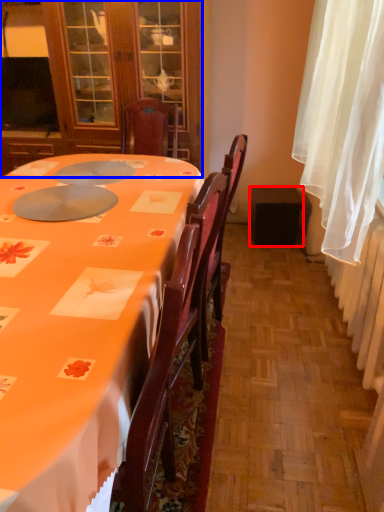
Question: Which point is closer to the camera, loudspeaker (highlighted by a red box) or cabinetry (highlighted by a blue box)?

Choices:
 (A) loudspeaker
 (B) cabinetry

Answer: (B)